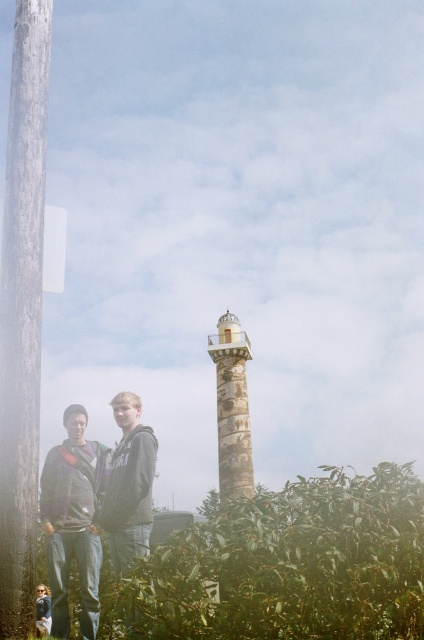
Question: Does green leafy bush at lower center have a lesser width compared to dark gray hoodie at center?

Choices:
 (A) no
 (B) yes

Answer: (A)

Question: Which of the following is the closest to the observer?

Choices:
 (A) dark gray hoodie at center
 (B) green leafy bush at lower center

Answer: (B)

Question: Considering the relative positions of green leafy bush at lower center and wooden telegraph pole at left in the image provided, where is green leafy bush at lower center located with respect to wooden telegraph pole at left?

Choices:
 (A) above
 (B) below

Answer: (B)

Question: Can you confirm if dark gray hoodie at center is smaller than stonework/light house at center?

Choices:
 (A) yes
 (B) no

Answer: (A)

Question: Which point is closer to the camera?

Choices:
 (A) green leafy bush at lower center
 (B) wooden telegraph pole at left

Answer: (B)

Question: Which point is closer to the camera?

Choices:
 (A) (16, 410)
 (B) (136, 506)

Answer: (A)